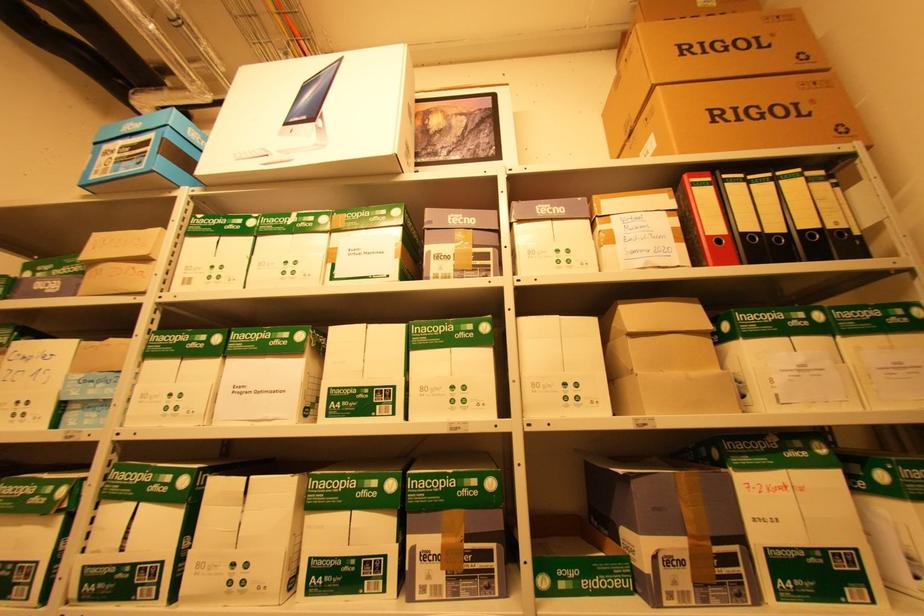
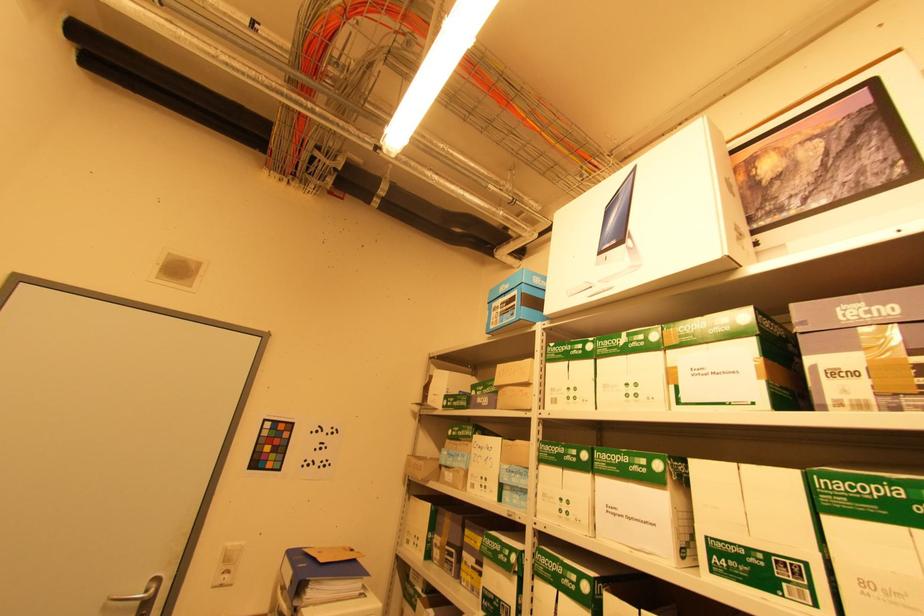
Question: How did the camera likely rotate?

Choices:
 (A) Left
 (B) Right
 (C) Up
 (D) Down

Answer: (A)